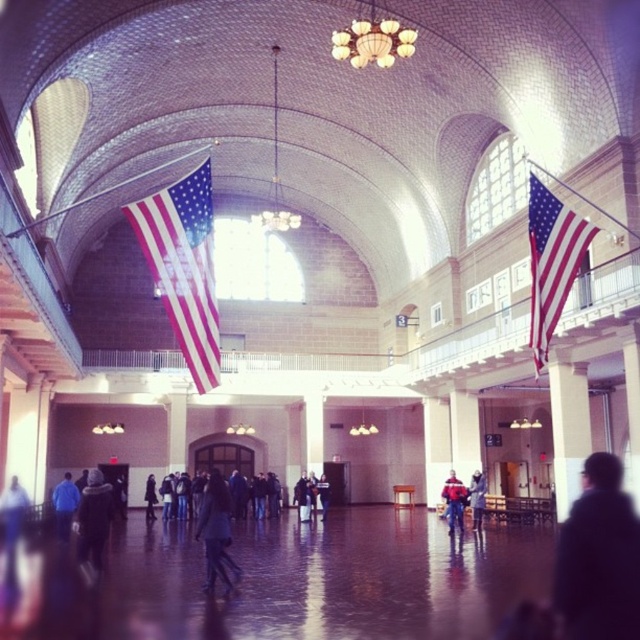
Can you confirm if matte fabric flag at center is positioned to the left of blue fabric jacket at lower left?

No, matte fabric flag at center is not to the left of blue fabric jacket at lower left.

Is matte fabric flag at center above blue fabric jacket at lower left?

Yes, matte fabric flag at center is above blue fabric jacket at lower left.

What are the coordinates of `matte fabric flag at center` in the screenshot? It's located at (182, 266).

Can you confirm if dark fuzzy coat at lower right is positioned below blue fabric jacket at lower left?

No, dark fuzzy coat at lower right is not below blue fabric jacket at lower left.

Is dark fuzzy coat at lower right positioned before blue fabric jacket at lower left?

Yes, dark fuzzy coat at lower right is in front of blue fabric jacket at lower left.

Where is `dark fuzzy coat at lower right`? The width and height of the screenshot is (640, 640). dark fuzzy coat at lower right is located at coordinates (598, 557).

Does matte american flag at right appear on the right side of dark gray jacket at center?

Yes, matte american flag at right is to the right of dark gray jacket at center.

Find the location of a particular element. matte american flag at right is located at coordinates (552, 260).

Between point (531, 353) and point (147, 492), which one is positioned behind?

The point (147, 492) is more distant.

You are a GUI agent. You are given a task and a screenshot of the screen. Output one action in this format:
    pyautogui.click(x=<x>, y=<y>)
    Task: Click on the matte american flag at right
    Image resolution: width=640 pixels, height=640 pixels.
    Given the screenshot: What is the action you would take?
    pyautogui.click(x=552, y=260)